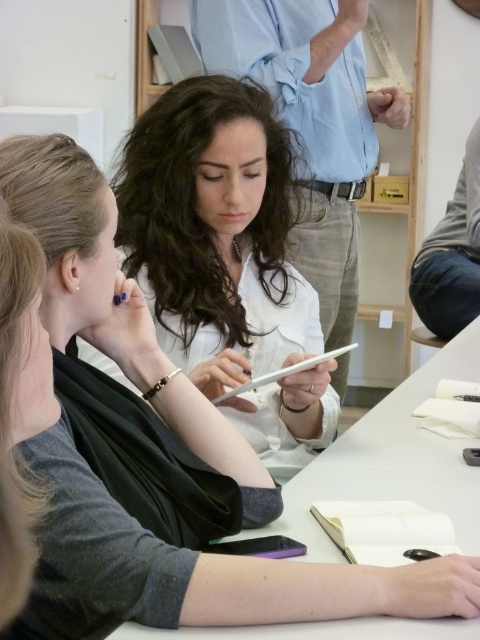
Question: Among these objects, which one is nearest to the camera?

Choices:
 (A) white matte table at center
 (B) white matte tablet at center

Answer: (A)

Question: Does white matte tablet at center appear on the right side of white matte table at center?

Choices:
 (A) no
 (B) yes

Answer: (A)

Question: Is white matte tablet at center smaller than white matte table at center?

Choices:
 (A) no
 (B) yes

Answer: (B)

Question: Can you confirm if white matte tablet at center is positioned to the right of white matte table at center?

Choices:
 (A) no
 (B) yes

Answer: (A)

Question: Which point is farther to the camera?

Choices:
 (A) white matte table at center
 (B) white matte tablet at center

Answer: (B)